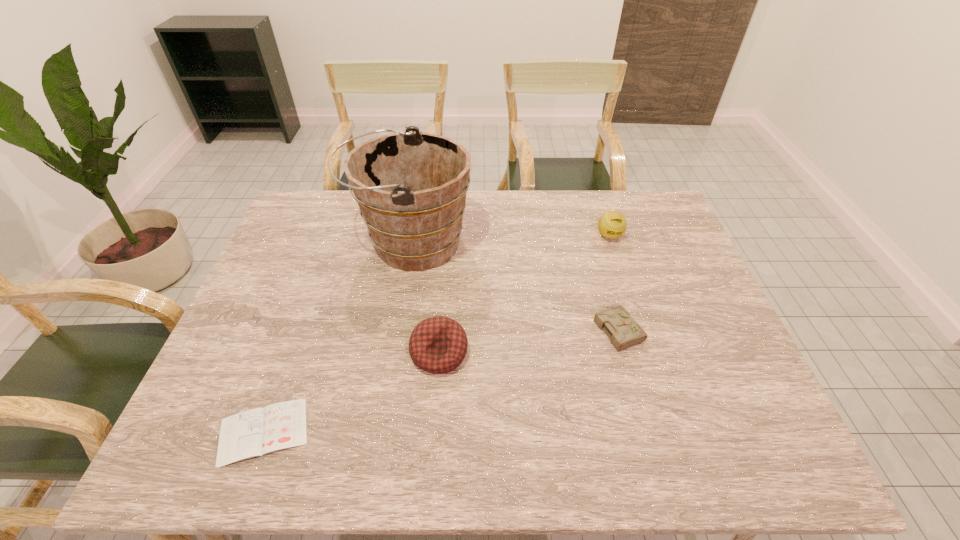
Identify the location of vacant region between the fourth tallest object and the bucket. (515, 285).

Where is `vacant area that lies between the right diary and the softball`? Image resolution: width=960 pixels, height=540 pixels. vacant area that lies between the right diary and the softball is located at coordinates (613, 282).

Where is `free area in between the right diary and the beanbag`? The height and width of the screenshot is (540, 960). free area in between the right diary and the beanbag is located at coordinates pos(529,340).

The image size is (960, 540). I want to click on free space that is in between the beanbag and the right diary, so click(x=529, y=340).

The height and width of the screenshot is (540, 960). I want to click on free spot between the softball and the beanbag, so click(x=524, y=294).

Point out which object is positioned as the fourth nearest to the beanbag. Please provide its 2D coordinates. Your answer should be formatted as a tuple, i.e. [(x, y)], where the tuple contains the x and y coordinates of a point satisfying the conditions above.

[(612, 224)]

You are a GUI agent. You are given a task and a screenshot of the screen. Output one action in this format:
    pyautogui.click(x=<x>, y=<y>)
    Task: Click on the third closest object to the beanbag
    This screenshot has height=540, width=960.
    Given the screenshot: What is the action you would take?
    pyautogui.click(x=624, y=332)

Where is `free space that satisfies the following two spatial constraints: 1. on the back side of the beanbag; 2. on the left side of the nearest object`? This screenshot has width=960, height=540. free space that satisfies the following two spatial constraints: 1. on the back side of the beanbag; 2. on the left side of the nearest object is located at coordinates pos(292,353).